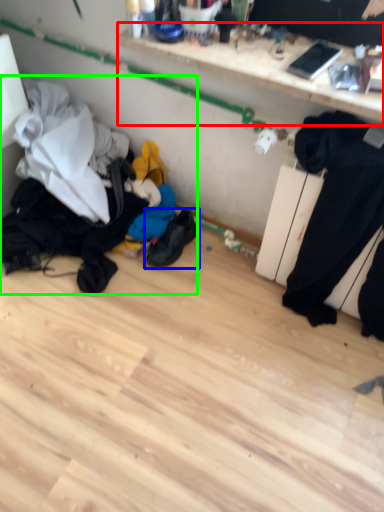
Question: Considering the real-world distances, which object is closest to shelf (highlighted by a red box)? footwear (highlighted by a blue box) or laundry (highlighted by a green box).

Choices:
 (A) footwear
 (B) laundry

Answer: (B)